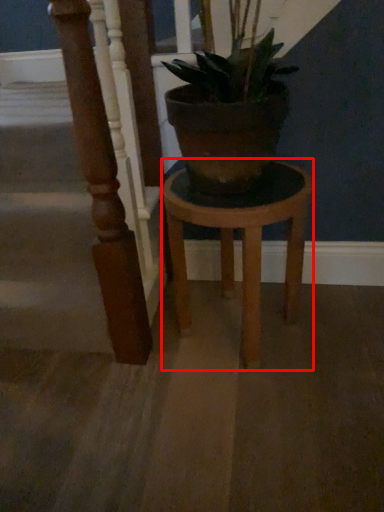
Question: From the image's perspective, where is stool (annotated by the red box) located relative to pillar?

Choices:
 (A) below
 (B) above

Answer: (A)